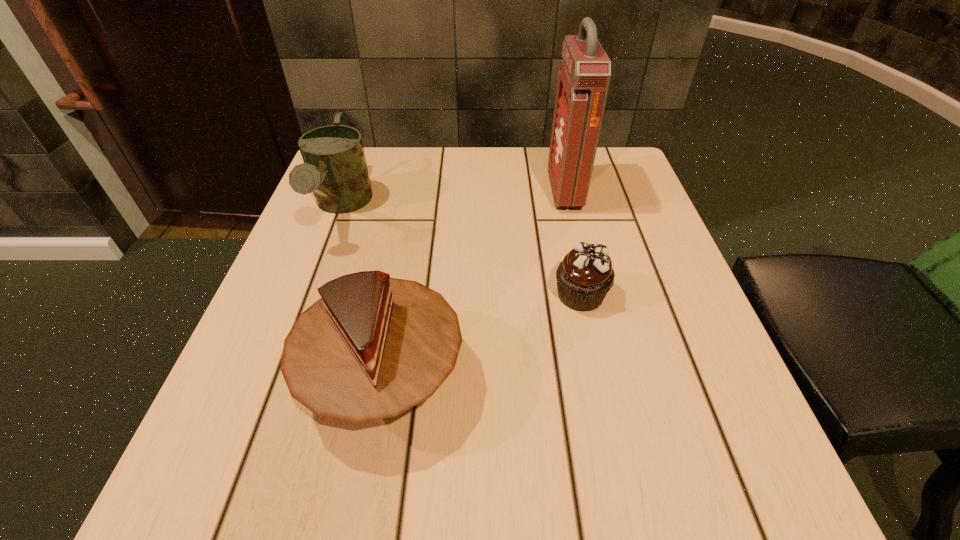
Where is `blank space that satisfies the following two spatial constraints: 1. on the front-facing side of the first-aid kit; 2. with the spout on the watering can`? blank space that satisfies the following two spatial constraints: 1. on the front-facing side of the first-aid kit; 2. with the spout on the watering can is located at coordinates (568, 206).

Where is `free region that satisfies the following two spatial constraints: 1. with the spout on the shortest object; 2. on the left side of the watering can`? free region that satisfies the following two spatial constraints: 1. with the spout on the shortest object; 2. on the left side of the watering can is located at coordinates (308, 295).